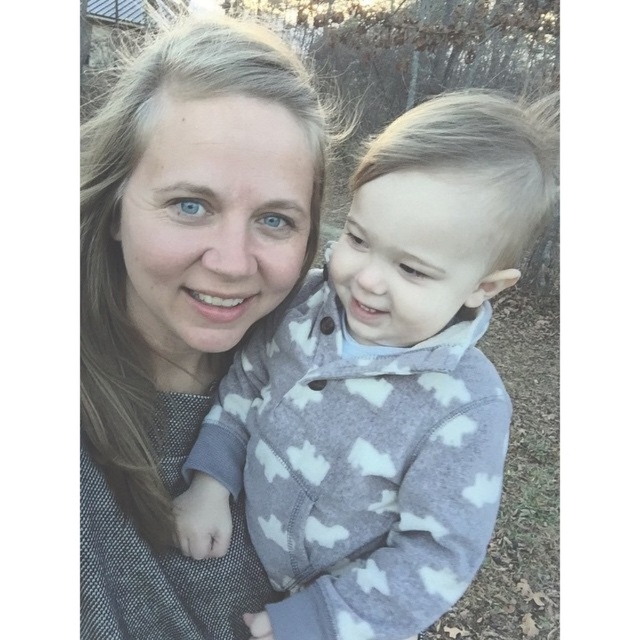
Is fuzzy gray sweater at center above matte gray sweater at center?

Yes.

Find the location of `fuzzy gray sweater at center`. fuzzy gray sweater at center is located at coordinates 381,384.

Identify the location of fuzzy gray sweater at center. The width and height of the screenshot is (640, 640). (381, 384).